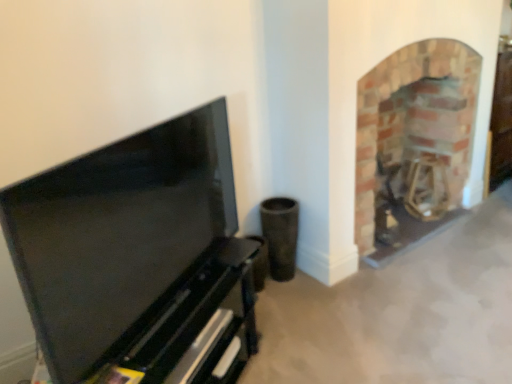
Find the location of a particular element. The width and height of the screenshot is (512, 384). free spot below matte black tv stand at left (from a real-world perspective) is located at coordinates (178, 304).